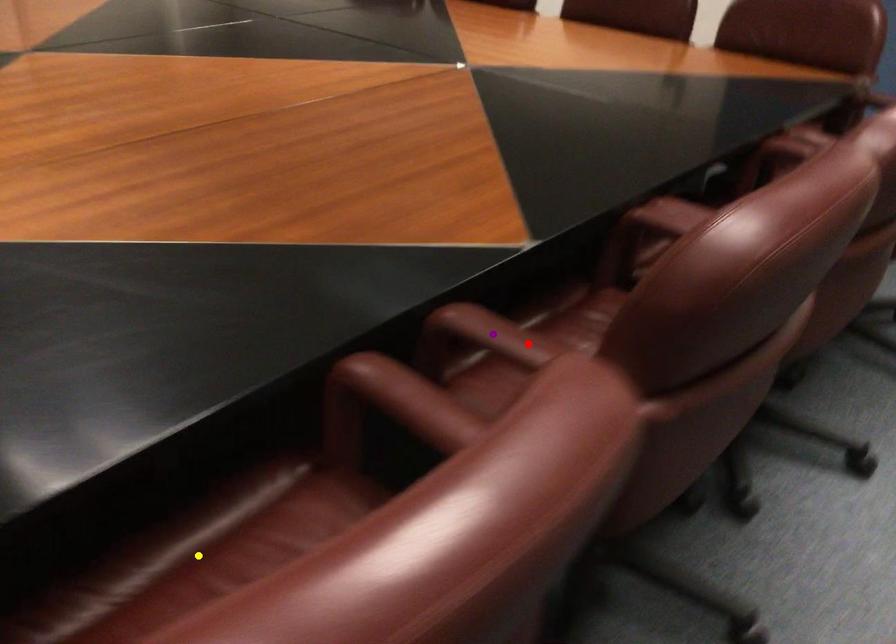
Order these from nearest to farthest:
- red point
- yellow point
- purple point

1. red point
2. purple point
3. yellow point